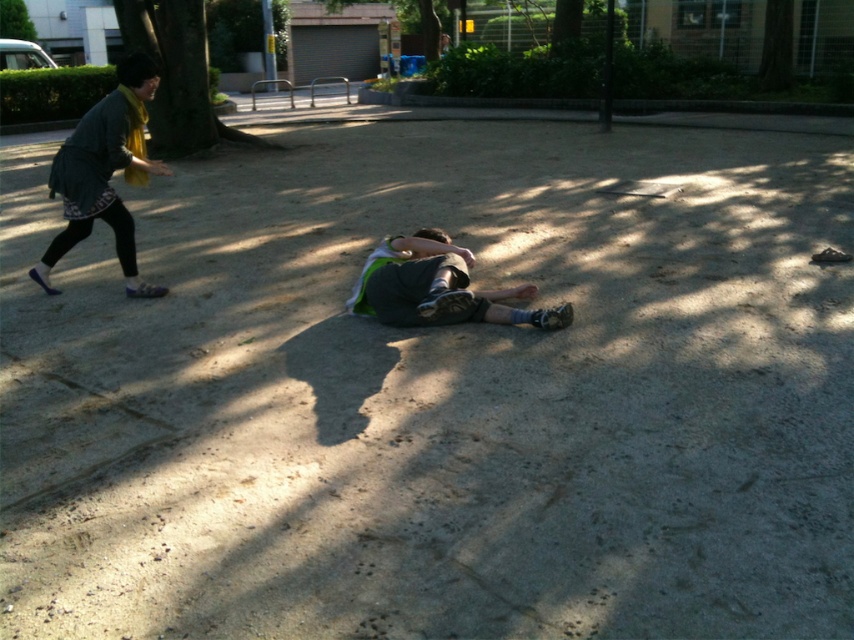
Question: In this image, where is green fabric shirt at center located relative to green fabric shorts at center?

Choices:
 (A) above
 (B) below

Answer: (A)

Question: Can you confirm if green fabric shirt at center is positioned to the left of green fabric shorts at center?

Choices:
 (A) yes
 (B) no

Answer: (A)

Question: Is green fabric shirt at center wider than green fabric shorts at center?

Choices:
 (A) no
 (B) yes

Answer: (A)

Question: Which point is farther from the camera taking this photo?

Choices:
 (A) (423, 253)
 (B) (92, 209)

Answer: (B)

Question: Which of the following is the closest to the observer?

Choices:
 (A) green fabric shirt at center
 (B) green fabric shorts at center

Answer: (B)